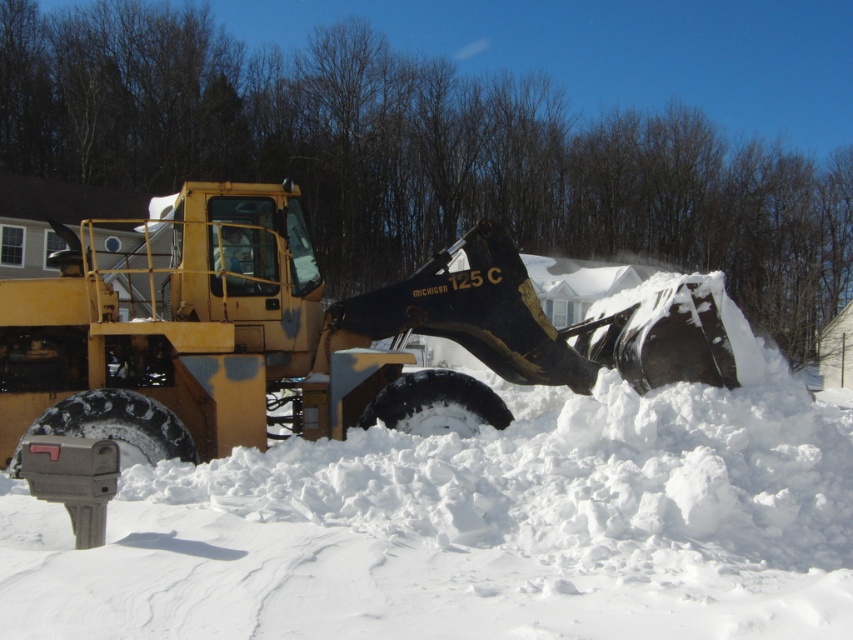
You are a drone operator trying to capture a photo of the Michigan 125C front end loader in the snowy scene. The drone is currently hovering above the white fluffy snow at center. To get the best shot, you need to move the drone north by 0.3 units. Will the drone still be within the image frame after moving north?

The 2D location of white fluffy snow at center is at point (476, 525). Moving north by 0.3 units would adjust the y coordinate. Assuming the image frame spans from 0 to 1 in both x and y axes, moving north would increase the y value. The new y coordinate would be 0.559 0.3. However, since 0.559 0.3 equals 0.859, which is still within the 0 to 1 range. Therefore, the drone will remain within the image frame after moving north.

Looking at this image, you are a delivery person trying to reach the mailbox in the snow. The white fluffy snow at center and the yellow metallic tractor at center are in your way. Which object is shorter and can be stepped over easily?

The white fluffy snow at center is shorter than the yellow metallic tractor at center, so you can step over the white fluffy snow at center easily.